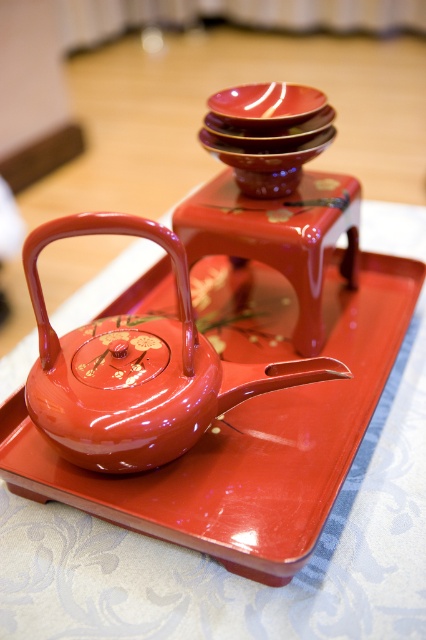
You are setting up a display for a tea ceremony and need to ensure the glossy lacquer teapot at center is visible. Since the glossy fabric tray at center is taller than the teapot, will the teapot be fully visible when placed on the tray?

The glossy fabric tray at center is taller than the glossy lacquer teapot at center, so when placed on the tray, the teapot might not be fully visible due to the tray being taller.

You are a server in a restaurant and need to place a 16 inch long decorative ribbon between the glossy fabric tray at center and the glossy ceramic plate at upper center. Can the ribbon fit between them without overlapping either object?

The distance between the glossy fabric tray at center and the glossy ceramic plate at upper center is 16.82 inches, which is slightly longer than the 16 inch ribbon. Therefore, the ribbon can fit between them without overlapping either object.